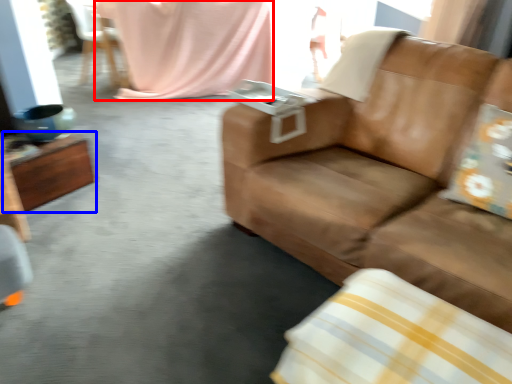
Question: Which point is further to the camera, blanket (highlighted by a red box) or table (highlighted by a blue box)?

Choices:
 (A) blanket
 (B) table

Answer: (A)